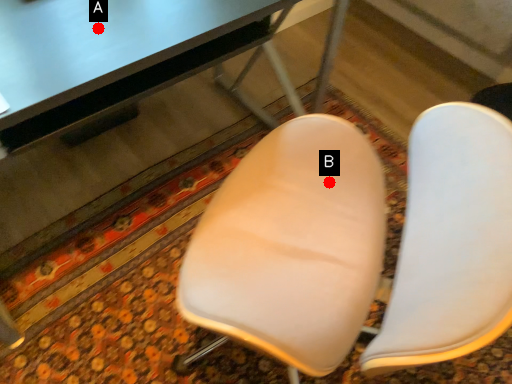
Question: Two points are circled on the image, labeled by A and B beside each circle. Which point is farther to the camera?

Choices:
 (A) A is further
 (B) B is further

Answer: (B)